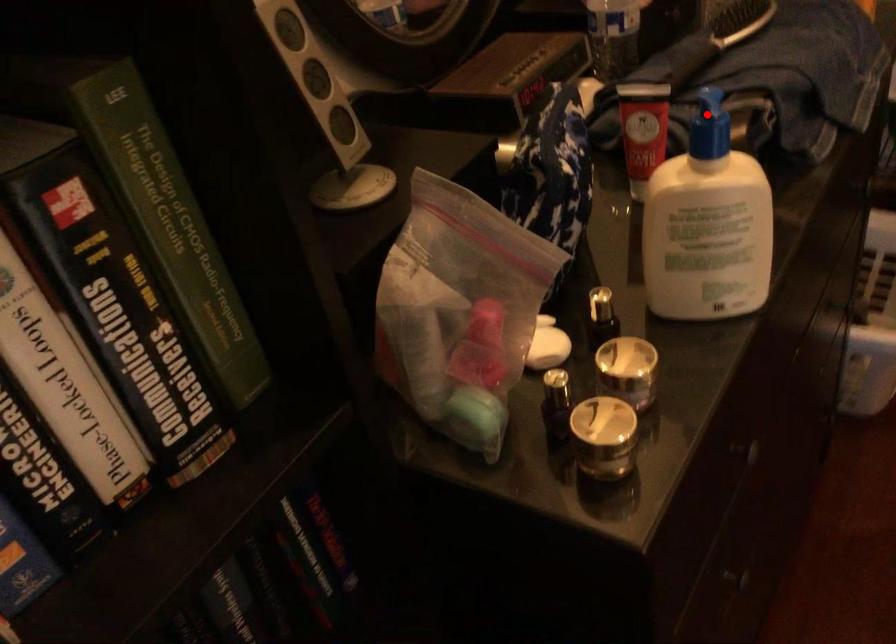
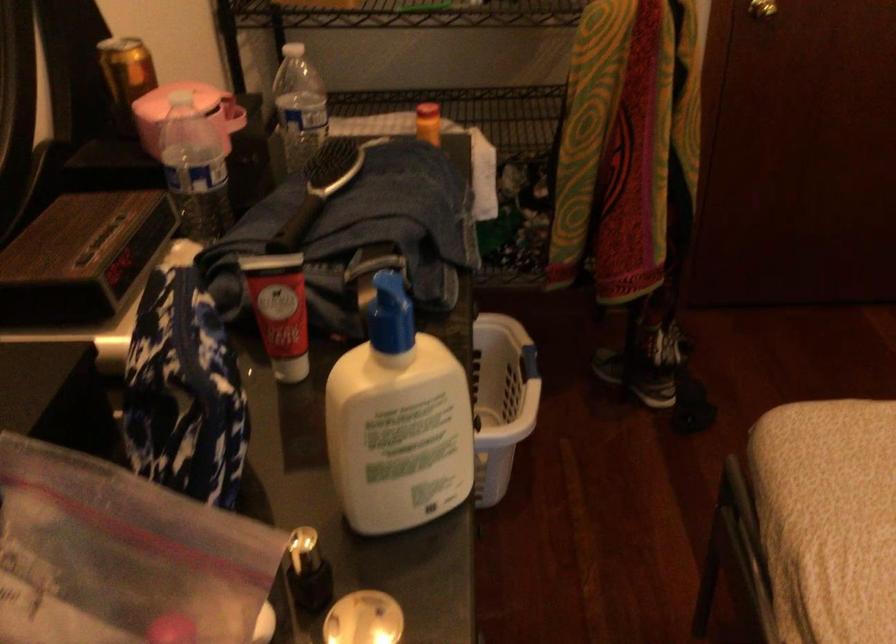
Where in the second image is the point corresponding to the highlighted location from the first image?

(391, 314)